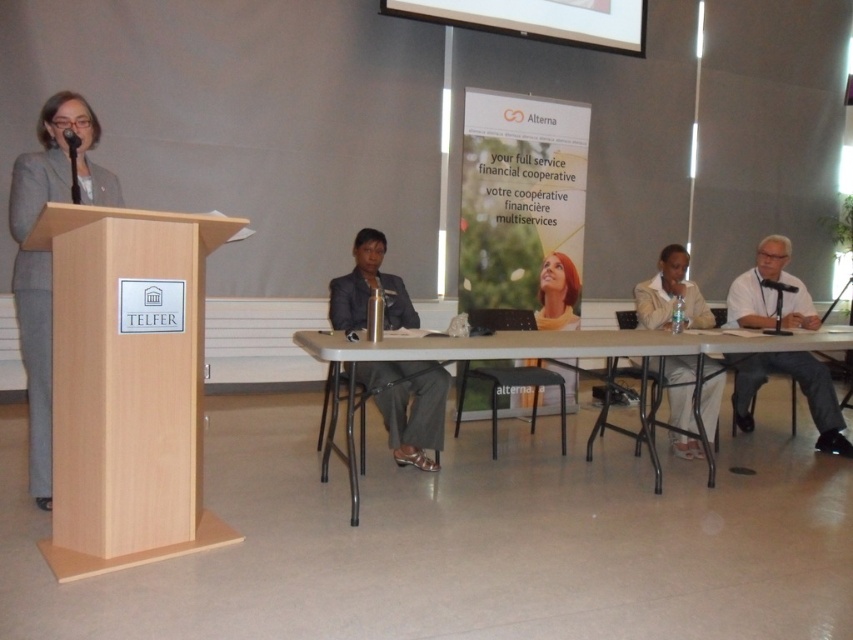
Does white plastic table at center have a lesser width compared to black fabric business suit at center?

Incorrect, white plastic table at center's width is not less than black fabric business suit at center's.

Does white plastic table at center have a greater width compared to black fabric business suit at center?

Correct, the width of white plastic table at center exceeds that of black fabric business suit at center.

Does point (643, 420) come in front of point (389, 396)?

No, (643, 420) is further to viewer.

Where is `white plastic table at center`? white plastic table at center is located at coordinates (567, 352).

Who is lower down, light wood podium at left or white plastic table at center?

white plastic table at center is below.

Is point (70, 211) more distant than point (408, 340)?

No, it is not.

Image resolution: width=853 pixels, height=640 pixels. Identify the location of light wood podium at left. (126, 385).

Measure the distance between white shirt at right and camera.

They are 4.12 meters apart.

You are a GUI agent. You are given a task and a screenshot of the screen. Output one action in this format:
    pyautogui.click(x=<x>, y=<y>)
    Task: Click on the white shirt at right
    The width and height of the screenshot is (853, 640).
    Given the screenshot: What is the action you would take?
    pyautogui.click(x=799, y=388)